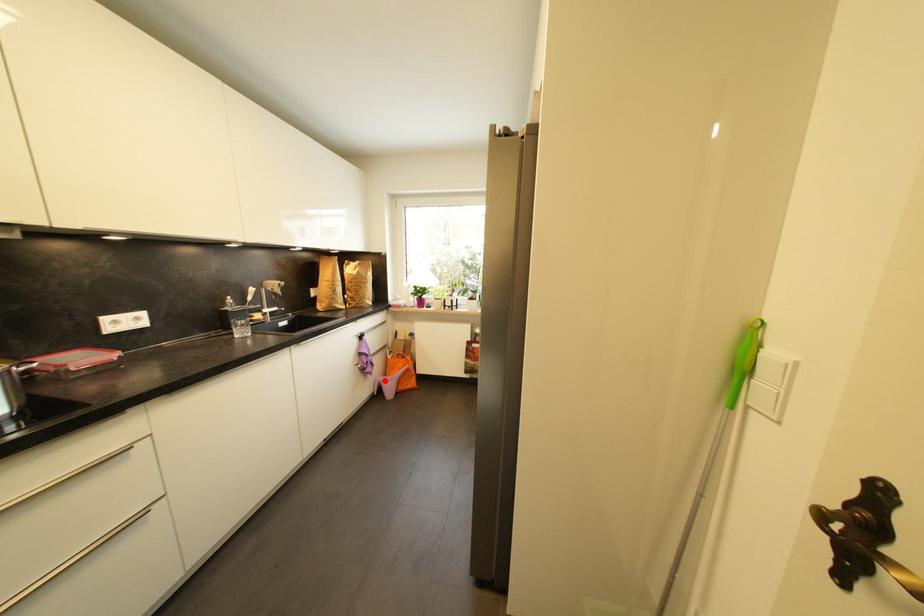
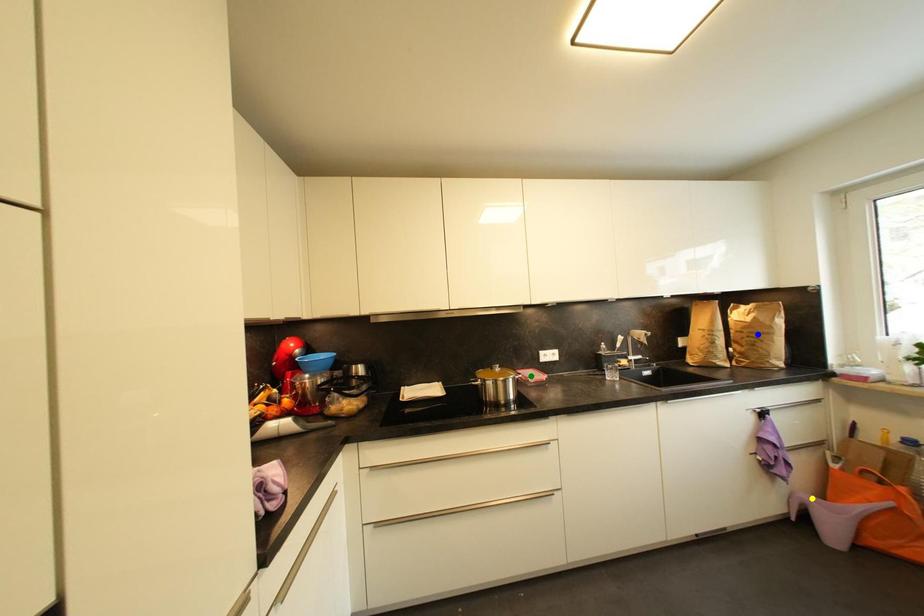
Question: I am providing you with two images of the same scene from different viewpoints. A red point is marked on the first image. You are given multiple points on the second image. Which spot in image 2 lines up with the point in image 1?

Choices:
 (A) yellow point
 (B) blue point
 (C) green point

Answer: (A)